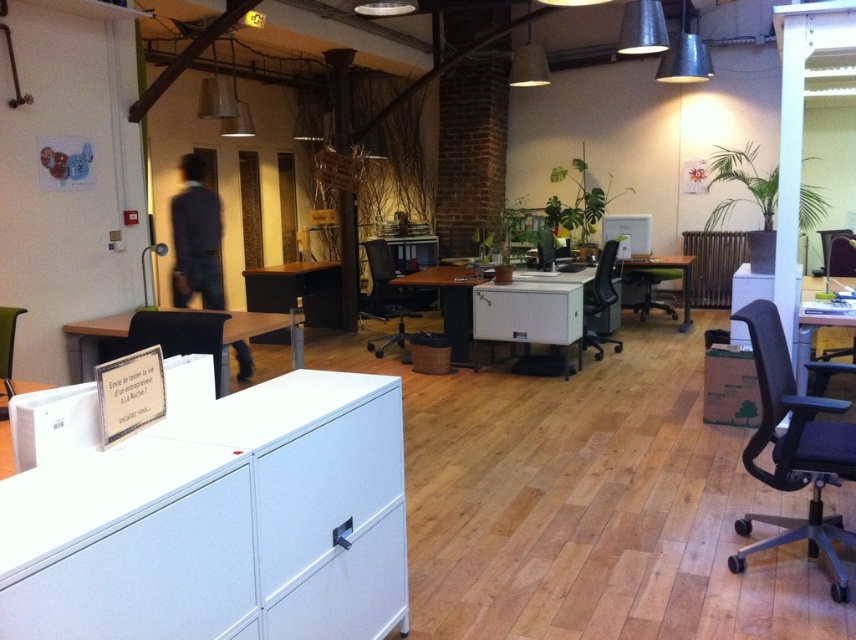
Question: Which point is farther to the camera?

Choices:
 (A) (657, 259)
 (B) (220, 371)

Answer: (A)

Question: Among these objects, which one is nearest to the camera?

Choices:
 (A) white glossy table at center
 (B) matte black office chair at center
 (C) matte black chair at left

Answer: (C)

Question: Where is black mesh swivel chair at right located in relation to green matte desk at center in the image?

Choices:
 (A) above
 (B) below

Answer: (B)

Question: Among these objects, which one is farthest from the camera?

Choices:
 (A) matte black chair at left
 (B) black mesh office chair at center
 (C) white matte file cabinet at lower left
 (D) matte black office chair at center

Answer: (B)

Question: Does white laminate table at center appear under white glossy table at right?

Choices:
 (A) no
 (B) yes

Answer: (A)

Question: Can you confirm if matte black chair at left is bigger than black mesh office chair at center?

Choices:
 (A) yes
 (B) no

Answer: (B)